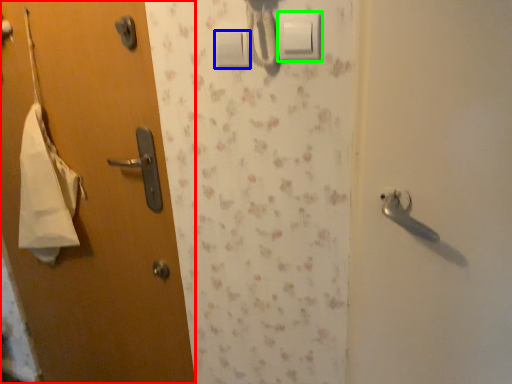
Question: Which object is positioned farthest from door (highlighted by a red box)? Select from light switch (highlighted by a blue box) and light switch (highlighted by a green box).

Choices:
 (A) light switch
 (B) light switch

Answer: (B)